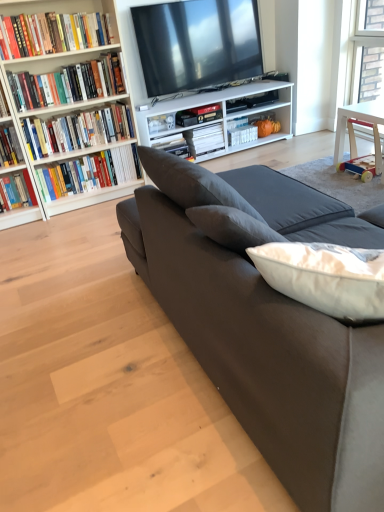
Question: Considering the relative positions of white matte book at center, the 6th book viewed from the front, and hardcover book at left, which is the 4th book in front-to-back order, in the image provided, is white matte book at center, the 6th book viewed from the front, to the left or to the right of hardcover book at left, which is the 4th book in front-to-back order,?

Choices:
 (A) left
 (B) right

Answer: (B)

Question: Considering the positions of white matte book at center, which ranks as the 2th book in back-to-front order, and hardcover book at left, which is the 4th book in front-to-back order, in the image, is white matte book at center, which ranks as the 2th book in back-to-front order, bigger or smaller than hardcover book at left, which is the 4th book in front-to-back order,?

Choices:
 (A) big
 (B) small

Answer: (A)

Question: Which object is the closest to the hardcover book at upper left, which appears as the 1th book when viewed from the front?

Choices:
 (A) hardcover book at left, which is the 4th book in front-to-back order
 (B) hardcover book at left, positioned as the fifth book in front-to-back order
 (C) white matte book at center, positioned as the 1th book in back-to-front order
 (D) white matte book at center, the 6th book viewed from the front
 (E) white wood table at right

Answer: (B)

Question: Which object is the farthest from the suede couch at center?

Choices:
 (A) matte black tv at upper center
 (B) white matte book at center, which ranks as the 2th book in back-to-front order
 (C) white wood table at right
 (D) white wood bookshelf at left
 (E) hardcover book at upper left, which ranks as the seventh book in back-to-front order

Answer: (A)